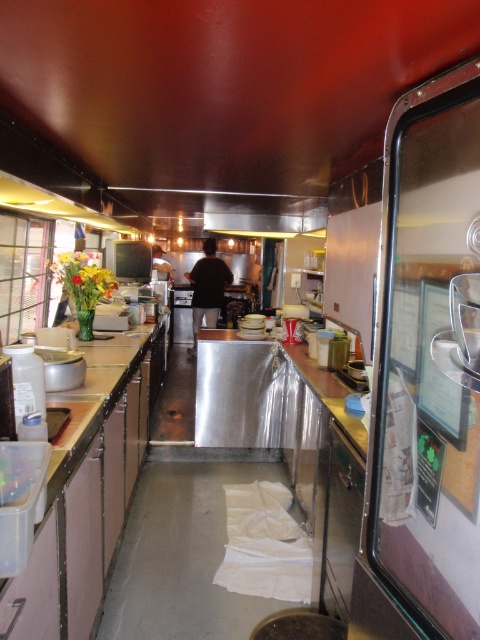
Question: Which object is the farthest from the dark brown leather jacket at center?

Choices:
 (A) metallic stainless steel door at center
 (B) brown laminate counter at left

Answer: (A)

Question: Considering the relative positions of metallic stainless steel door at center and dark brown fabric at center in the image provided, where is metallic stainless steel door at center located with respect to dark brown fabric at center?

Choices:
 (A) above
 (B) below

Answer: (B)

Question: Is metallic stainless steel door at center in front of dark brown leather jacket at center?

Choices:
 (A) yes
 (B) no

Answer: (A)

Question: Among these objects, which one is nearest to the camera?

Choices:
 (A) brown laminate counter at left
 (B) silver metallic counter at center

Answer: (A)

Question: Is silver metallic counter at center positioned in front of dark brown fabric at center?

Choices:
 (A) no
 (B) yes

Answer: (B)

Question: Which object is the farthest from the dark brown fabric at center?

Choices:
 (A) metallic stainless steel door at center
 (B) brown laminate counter at left
 (C) silver metallic counter at center
 (D) dark brown leather jacket at center

Answer: (A)